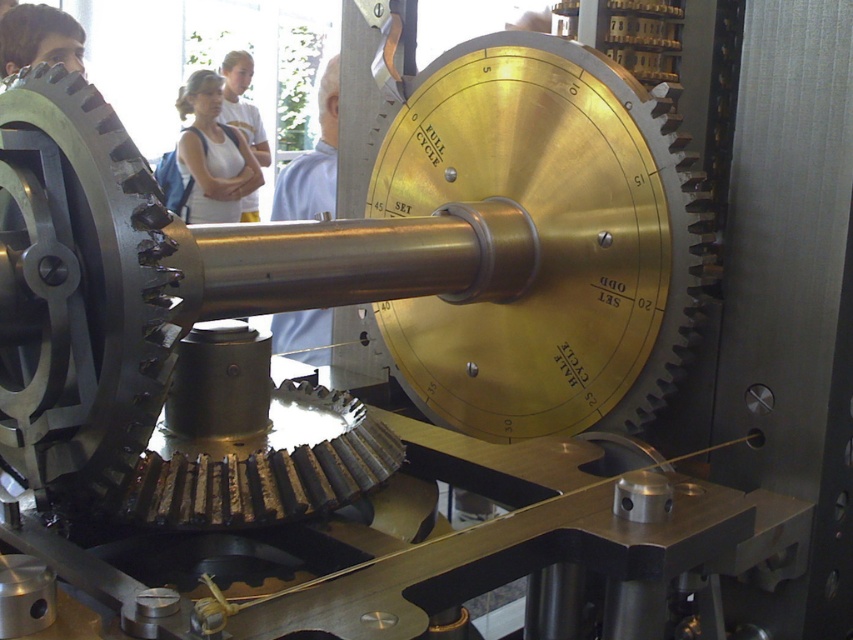
Can you confirm if white shirt at upper center is thinner than matte black gear at upper left?

In fact, white shirt at upper center might be wider than matte black gear at upper left.

Based on the photo, can you confirm if white shirt at upper center is positioned above matte black gear at upper left?

Incorrect, white shirt at upper center is not positioned above matte black gear at upper left.

What do you see at coordinates (312, 161) in the screenshot? This screenshot has width=853, height=640. I see `white shirt at upper center` at bounding box center [312, 161].

The height and width of the screenshot is (640, 853). I want to click on white shirt at upper center, so 312,161.

Is white shirt at upper center positioned in front of white cotton shirt at upper center?

That is True.

Who is positioned more to the left, white shirt at upper center or white cotton shirt at upper center?

Positioned to the left is white cotton shirt at upper center.

Which is in front, point (325, 92) or point (253, 108)?

Point (325, 92) is more forward.

This screenshot has width=853, height=640. I want to click on white shirt at upper center, so click(312, 161).

Between white cotton shirt at upper left and matte black gear at upper left, which one is positioned higher?

matte black gear at upper left is higher up.

Is white cotton shirt at upper left positioned at the back of matte black gear at upper left?

That is True.

Find the location of a particular element. The width and height of the screenshot is (853, 640). white cotton shirt at upper left is located at coordinates (212, 154).